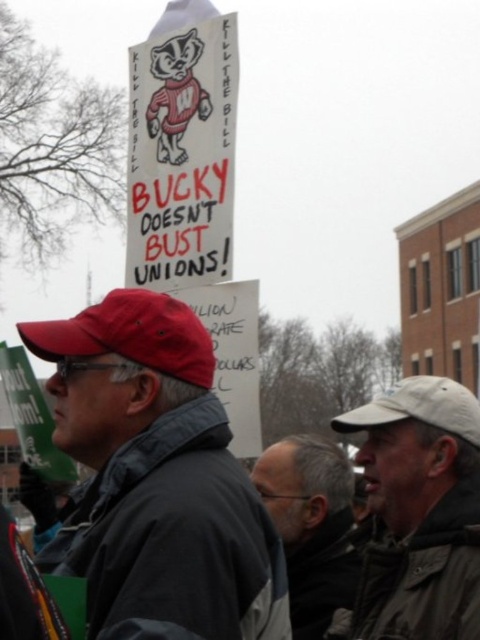
You are a photographer trying to capture a photo of both the red fabric cap at left and the white fabric cap at upper right in the same frame. Given that your camera has a maximum zoom range of 10 meters, can you position yourself to include both caps in the shot?

The red fabric cap at left is 8.72 meters away from the white fabric cap at upper right. Since the distance between them is within the camera maximum zoom range of 10 meters, you can position yourself to include both caps in the shot.

What is located at the coordinates point (156, 474) in the protest scene?

The red fabric cap at left is located at point (156, 474).